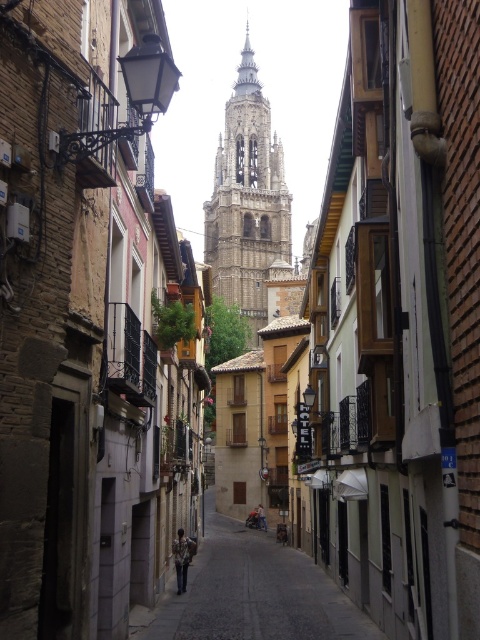
Question: Is smooth stone pavement at center to the left of golden stone tower at center from the viewer's perspective?

Choices:
 (A) yes
 (B) no

Answer: (A)

Question: Can you confirm if smooth stone pavement at center is bigger than golden stone tower at center?

Choices:
 (A) yes
 (B) no

Answer: (B)

Question: Which point is closer to the camera taking this photo?

Choices:
 (A) (268, 269)
 (B) (147, 634)

Answer: (B)

Question: Considering the relative positions of smooth stone pavement at center and golden stone tower at center in the image provided, where is smooth stone pavement at center located with respect to golden stone tower at center?

Choices:
 (A) below
 (B) above

Answer: (A)